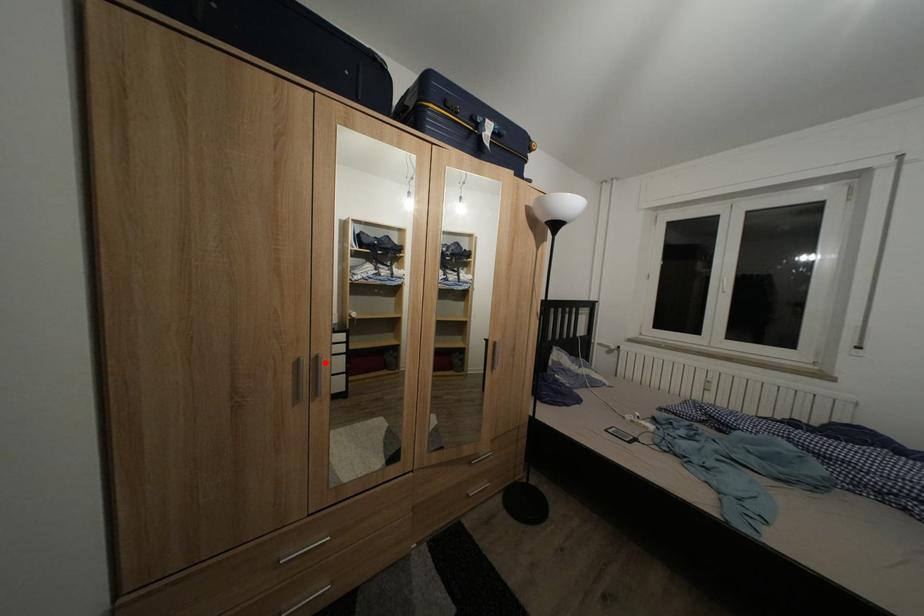
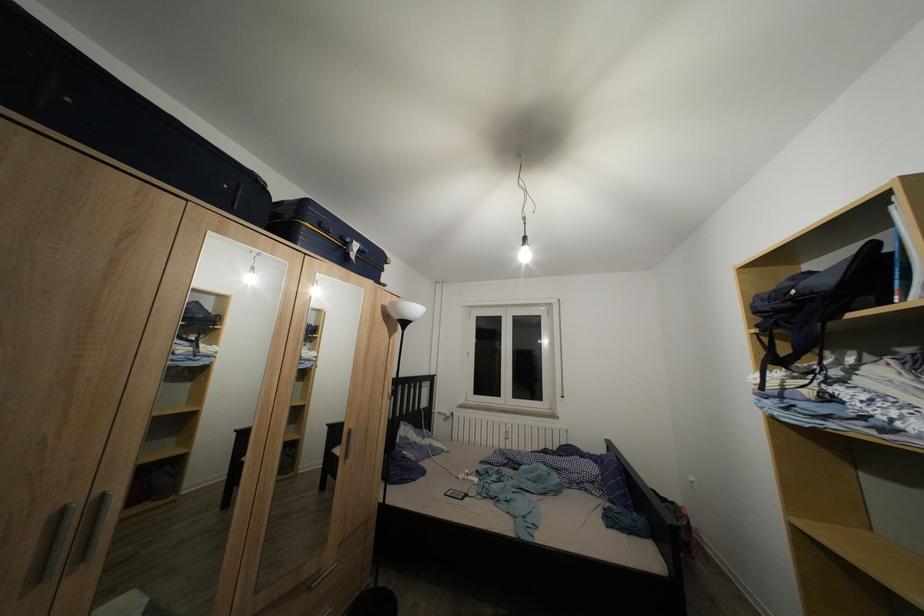
The point at the highlighted location is marked in the first image. Where is the corresponding point in the second image?

(111, 503)